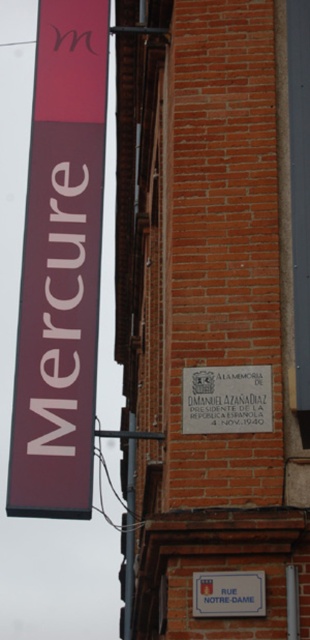
Between matte white plaque at center and white plastic sign at lower center, which one is positioned lower?

white plastic sign at lower center is below.

Is point (269, 392) farther from viewer compared to point (247, 572)?

Yes, it is behind point (247, 572).

Who is more distant from viewer, (264, 369) or (248, 616)?

The point (264, 369) is behind.

Where is `matte white plaque at center`? The height and width of the screenshot is (640, 310). matte white plaque at center is located at coordinates (226, 400).

Can you confirm if matte maroon sign at left is positioned below matte white plaque at center?

Incorrect, matte maroon sign at left is not positioned below matte white plaque at center.

Identify the location of matte maroon sign at left. (61, 266).

Is point (69, 77) behind point (76, 241)?

That is True.

Is point (41, 464) more distant than point (31, 444)?

That is False.

You are a GUI agent. You are given a task and a screenshot of the screen. Output one action in this format:
    pyautogui.click(x=<x>, y=<y>)
    Task: Click on the matte maroon sign at left
    Image resolution: width=310 pixels, height=640 pixels.
    Given the screenshot: What is the action you would take?
    pyautogui.click(x=61, y=266)